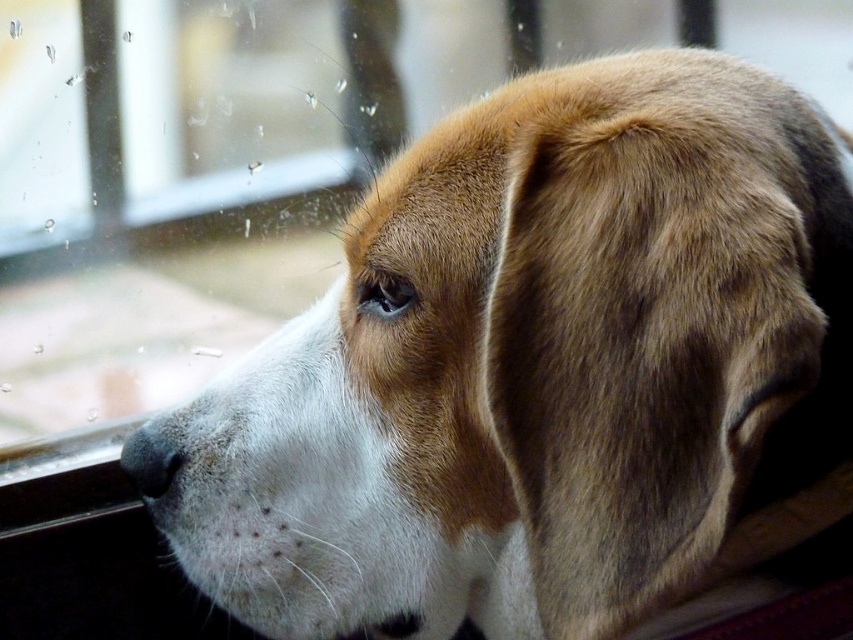
Question: Does black plastic window sill at lower left have a greater width compared to black matte nose at lower left?

Choices:
 (A) yes
 (B) no

Answer: (A)

Question: Can you confirm if black plastic window sill at lower left is wider than black matte nose at lower left?

Choices:
 (A) no
 (B) yes

Answer: (B)

Question: Is black plastic window sill at lower left to the left of black matte nose at lower left from the viewer's perspective?

Choices:
 (A) no
 (B) yes

Answer: (B)

Question: Which object is farther from the camera taking this photo?

Choices:
 (A) black matte nose at lower left
 (B) black plastic window sill at lower left

Answer: (B)

Question: Which point is closer to the camera?

Choices:
 (A) (160, 445)
 (B) (105, 426)

Answer: (A)